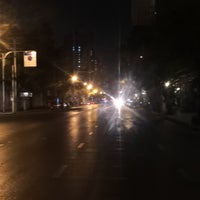
I want to click on bright light, so click(119, 105).